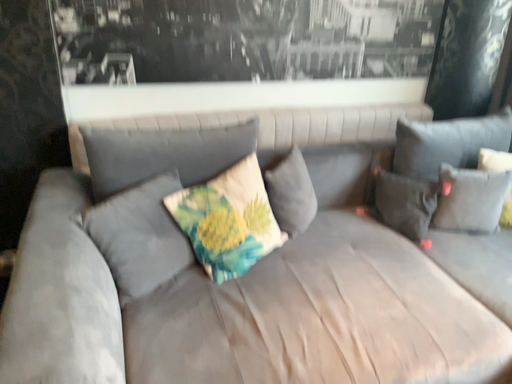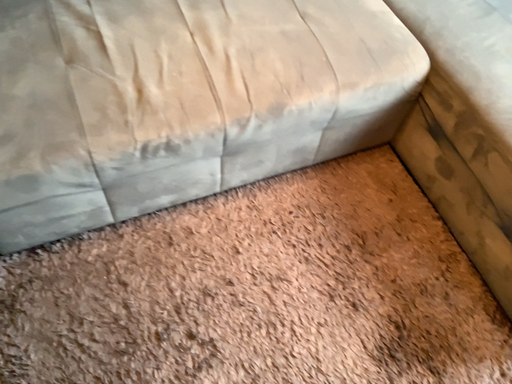
Question: How did the camera likely rotate when shooting the video?

Choices:
 (A) rotated downward
 (B) rotated upward

Answer: (A)